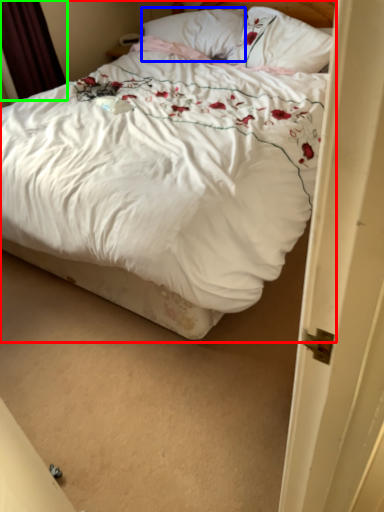
Question: Estimate the real-world distances between objects in this image. Which object is closer to bed (highlighted by a red box), pillow (highlighted by a blue box) or curtain (highlighted by a green box)?

Choices:
 (A) pillow
 (B) curtain

Answer: (B)